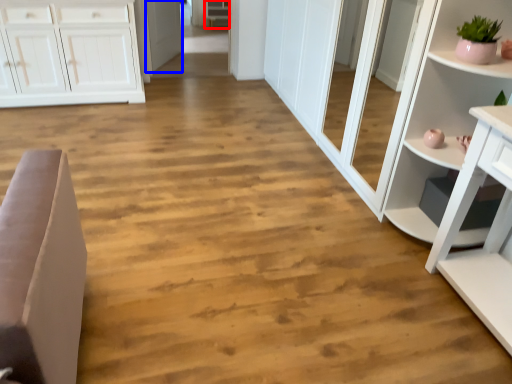
Question: Among these objects, which one is nearest to the camera, cabinetry (highlighted by a red box) or door (highlighted by a blue box)?

Choices:
 (A) cabinetry
 (B) door

Answer: (B)